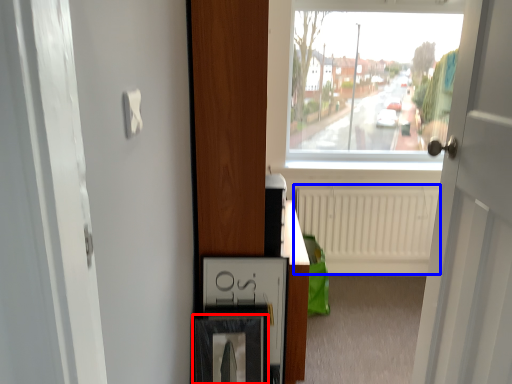
Question: Which point is closer to the camera, picture frame (highlighted by a red box) or radiator (highlighted by a blue box)?

Choices:
 (A) picture frame
 (B) radiator

Answer: (A)